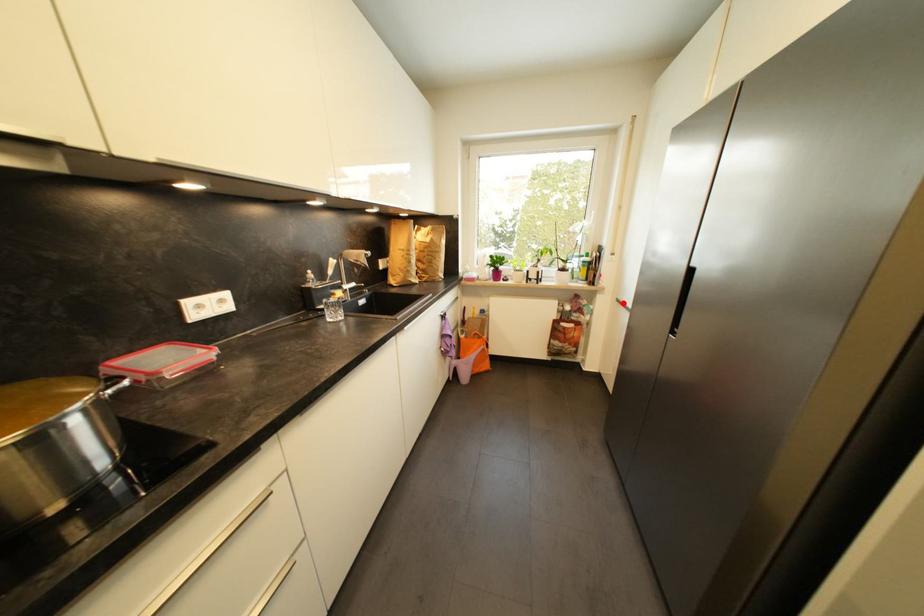
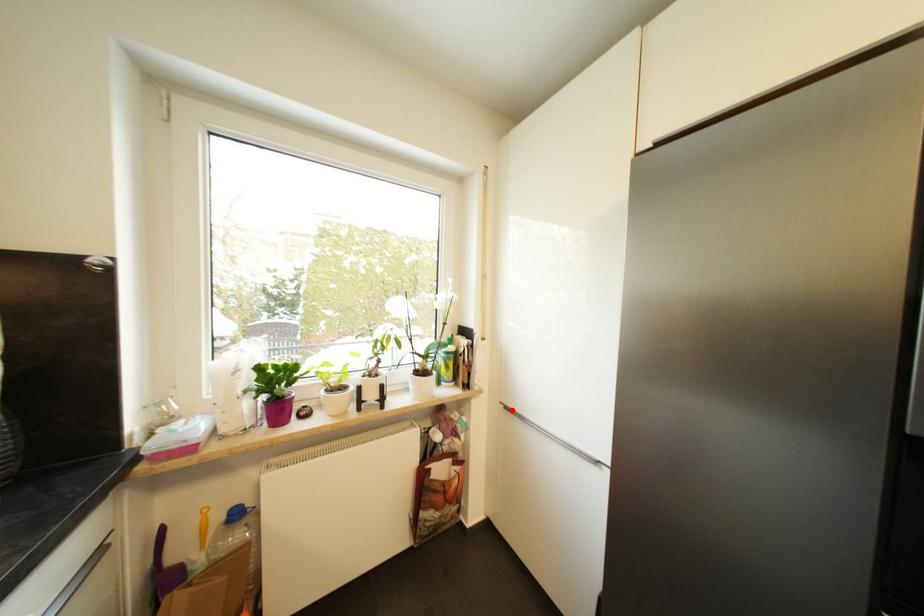
I am providing you with two images of the same scene from different viewpoints. A red point is marked on the first image and another point is marked on the second image. Does the point marked in image1 correspond to the same location as the one in image2?

Yes